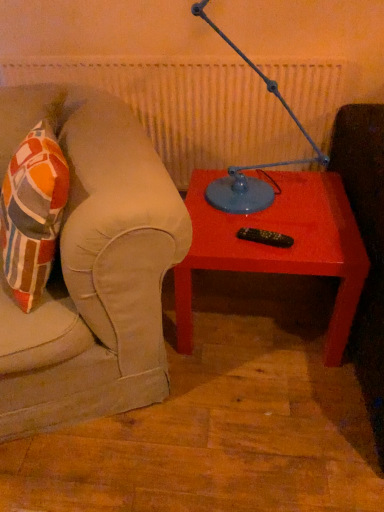
You are a GUI agent. You are given a task and a screenshot of the screen. Output one action in this format:
    pyautogui.click(x=<x>, y=<y>)
    Task: Click on the vacant space in front of matte red table at center
    The image size is (384, 512).
    Given the screenshot: What is the action you would take?
    pyautogui.click(x=245, y=425)